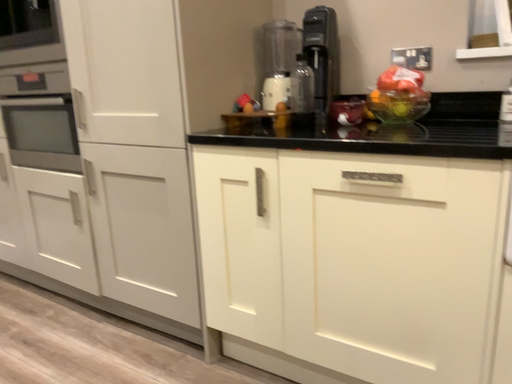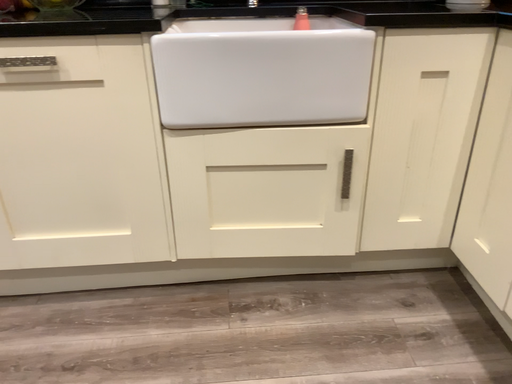
Question: Which way did the camera rotate in the video?

Choices:
 (A) rotated upward
 (B) rotated downward

Answer: (B)